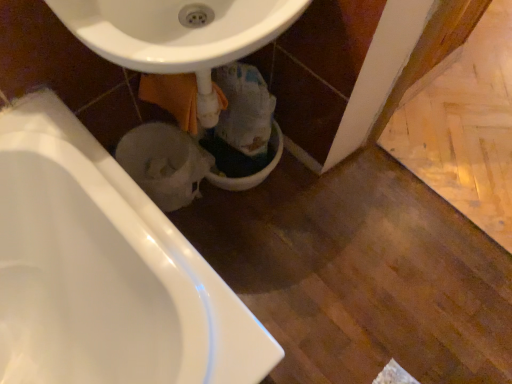
Question: From a real-world perspective, is white glossy toilet bowl at lower center, the first toilet bowl from the left, above or below white glossy bathtub at lower left?

Choices:
 (A) above
 (B) below

Answer: (B)

Question: Considering the positions of white glossy toilet bowl at lower center, the 2th toilet bowl from the right, and white glossy bathtub at lower left in the image, is white glossy toilet bowl at lower center, the 2th toilet bowl from the right, wider or thinner than white glossy bathtub at lower left?

Choices:
 (A) thin
 (B) wide

Answer: (A)

Question: Considering the real-world distances, which object is farthest from the white glossy sink at center?

Choices:
 (A) white glossy toilet bowl at lower center, the 2th toilet bowl from the right
 (B) white glossy bathtub at lower left
 (C) white glossy toilet bowl at center, the 1th toilet bowl in the right-to-left sequence

Answer: (C)

Question: Estimate the real-world distances between objects in this image. Which object is closer to the white glossy sink at center?

Choices:
 (A) white glossy bathtub at lower left
 (B) white glossy toilet bowl at lower center, the 2th toilet bowl from the right
 (C) white glossy toilet bowl at center, the 1th toilet bowl in the right-to-left sequence

Answer: (A)